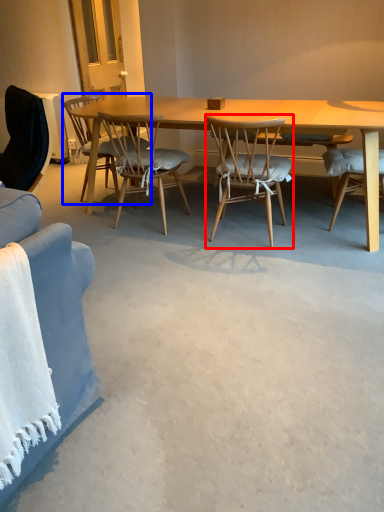
Question: Which object is further to the camera taking this photo, chair (highlighted by a red box) or chair (highlighted by a blue box)?

Choices:
 (A) chair
 (B) chair

Answer: (B)